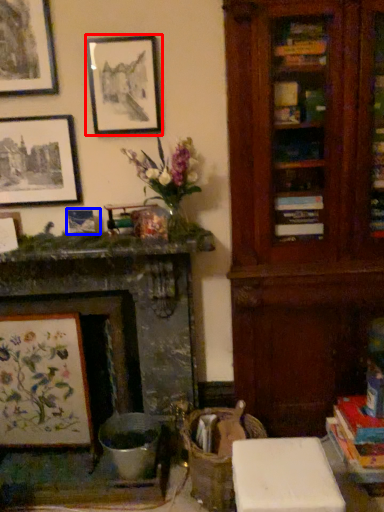
Question: Which of the following is the closest to the observer, picture frame (highlighted by a red box) or picture frame (highlighted by a blue box)?

Choices:
 (A) picture frame
 (B) picture frame

Answer: (A)